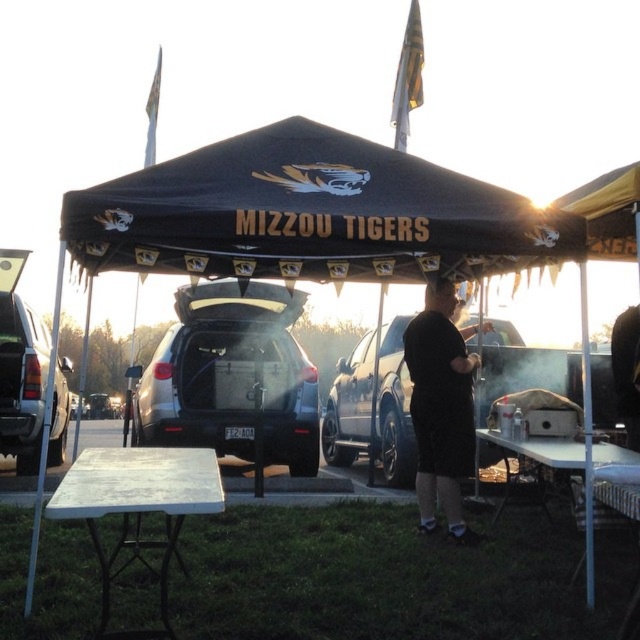
Question: From the image, what is the correct spatial relationship of white plastic picnic table at lower right in relation to black matte grill at center?

Choices:
 (A) right
 (B) left

Answer: (B)

Question: Can you confirm if black matte suv at center is positioned to the right of silver metallic truck at left?

Choices:
 (A) no
 (B) yes

Answer: (B)

Question: Among these points, which one is farthest from the camera?

Choices:
 (A) (422, 385)
 (B) (397, 472)

Answer: (B)

Question: Among these points, which one is farthest from the camera?

Choices:
 (A) (545, 458)
 (B) (440, 410)
 (C) (4, 381)
 (D) (515, 340)

Answer: (D)

Question: Is black matte shirt at center to the left of black matte grill at center from the viewer's perspective?

Choices:
 (A) no
 (B) yes

Answer: (B)

Question: Which point is farther to the camera?

Choices:
 (A) silver metallic truck at left
 (B) black matte shirt at center
 (C) black fabric canopy at center
 (D) white plastic table at lower left

Answer: (A)